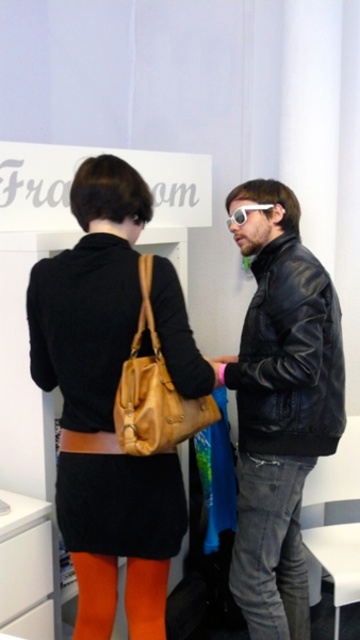
Based on the coordinates provided, which object is located at point (280, 406)?

The point at (280, 406) indicates the location of the black leather jacket at center.

Looking at this image, you are standing in the room and want to reach both the point at coordinates (160, 410) and the point at coordinates (241, 216). Which point should you approach first to get closer to the viewer?

Point at coordinates (160, 410) is closer to the viewer than point at coordinates (241, 216), so you should approach point at coordinates (160, 410) first.

Based on the photo, you are a fashion designer observing the scene. You need to determine which piece of clothing is higher in the image between the matte black dress at center and the denim jeans at lower center. Which one is higher?

The matte black dress at center is taller than denim jeans at lower center, so the matte black dress at center is higher in the image.